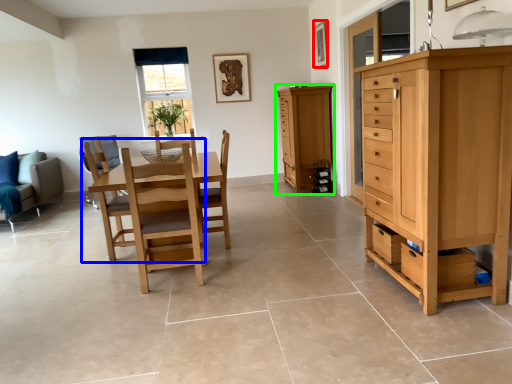
Question: Estimate the real-world distances between objects in this image. Which object is farther from picture frame (highlighted by a red box), chair (highlighted by a blue box) or cabinetry (highlighted by a green box)?

Choices:
 (A) chair
 (B) cabinetry

Answer: (A)